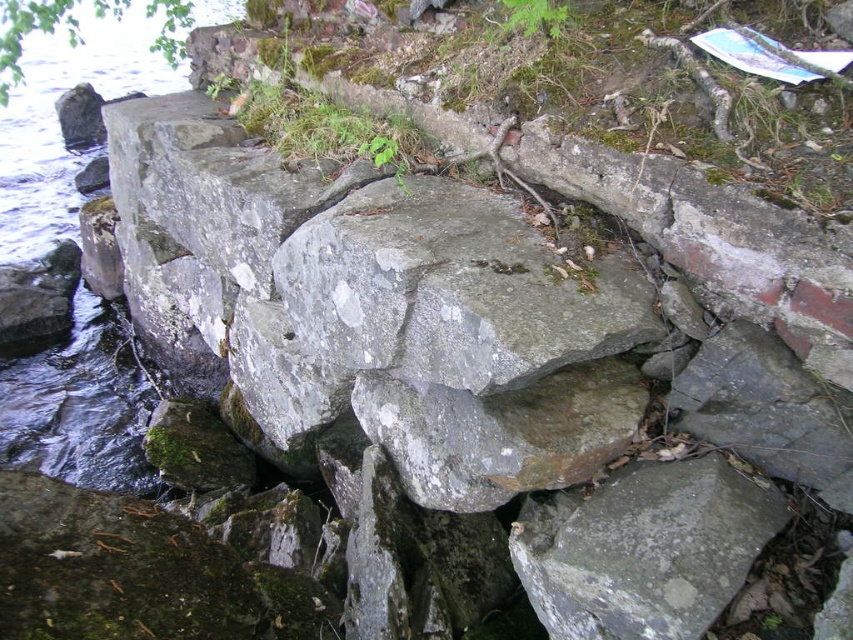
Question: Which object is farther from the camera taking this photo?

Choices:
 (A) gray rough stone at center
 (B) gray stone creek at left

Answer: (B)

Question: Which point is farther to the camera?

Choices:
 (A) (108, 397)
 (B) (485, 396)

Answer: (A)

Question: Where is gray stone creek at left located in relation to gray rough rock at center in the image?

Choices:
 (A) right
 (B) left

Answer: (B)

Question: Which object is positioned farthest from the gray stone creek at left?

Choices:
 (A) gray rough stone at center
 (B) gray rough rock at center

Answer: (A)

Question: Is gray stone creek at left thinner than gray rough rock at center?

Choices:
 (A) no
 (B) yes

Answer: (A)

Question: Does gray stone creek at left appear under gray rough stone at center?

Choices:
 (A) yes
 (B) no

Answer: (B)